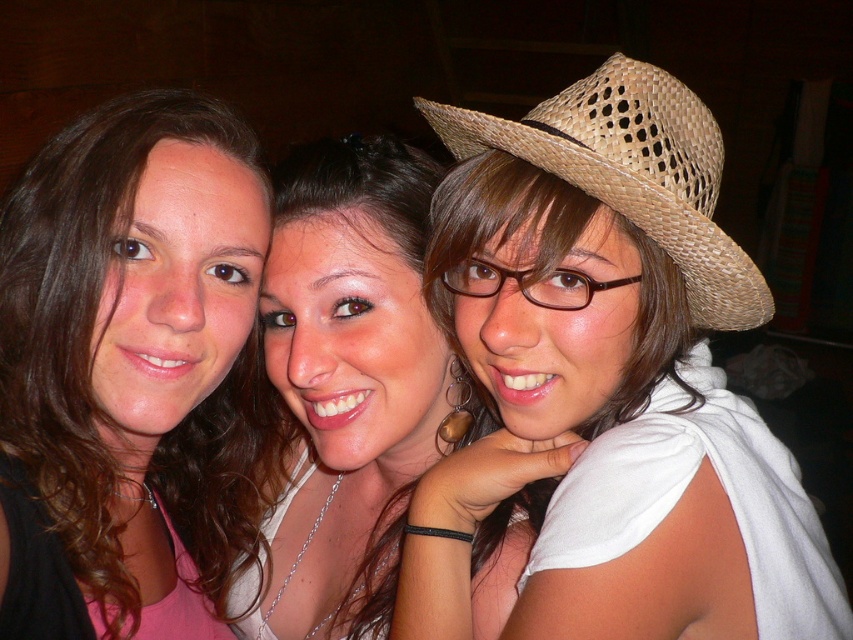
You are standing in a room where the image is displayed. You want to move from the matte pink shirt at left to the woven straw cowboy hat at upper right. In which direction should you move?

You should move to the right to go from the matte pink shirt at left to the woven straw cowboy hat at upper right since the matte pink shirt at left is to the left of the woven straw cowboy hat at upper right.

You are a photographer adjusting the camera focus. The camera can focus on objects within a 7 inch range. You need to focus on both the matte white shirt at center and the woven straw cowboy hat at upper right. Is it possible to capture both in focus with a single shot?

The distance between the matte white shirt at center and the woven straw cowboy hat at upper right is 8.20 inches, which exceeds the camera focus range of 7 inches. Therefore, it is not possible to capture both in focus with a single shot.